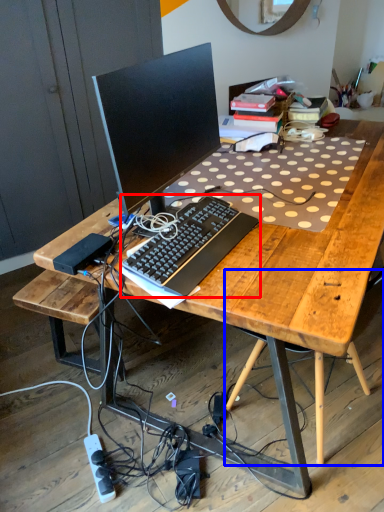
Question: Which point is further to the camera, computer keyboard (highlighted by a red box) or computer chair (highlighted by a blue box)?

Choices:
 (A) computer keyboard
 (B) computer chair

Answer: (A)